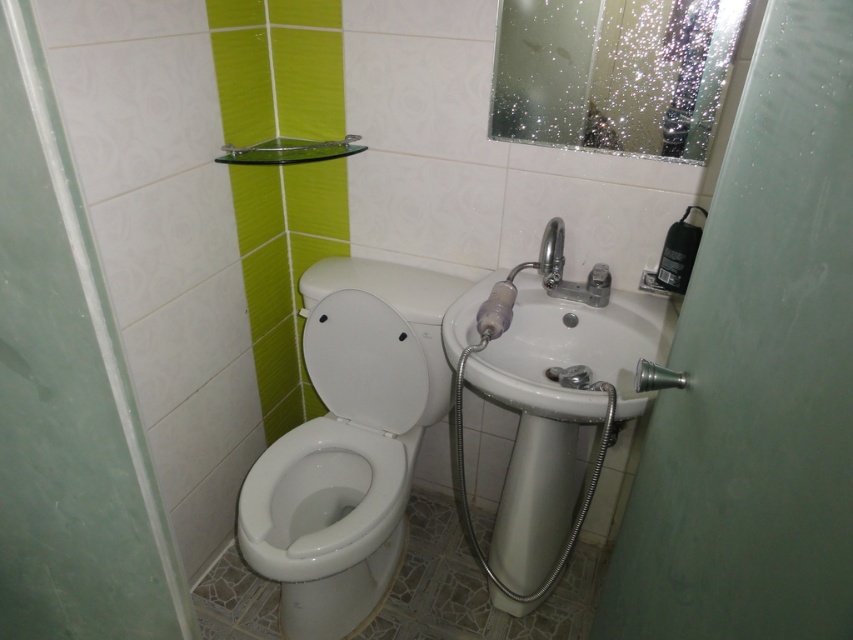
Question: Estimate the real-world distances between objects in this image. Which object is farther from the white glossy toilet at lower left?

Choices:
 (A) polished chrome faucet at upper right
 (B) white glossy bidet at center

Answer: (A)

Question: Does white glossy bidet at center have a lesser width compared to polished chrome faucet at upper right?

Choices:
 (A) yes
 (B) no

Answer: (B)

Question: Is white glossy toilet at lower left to the right of polished chrome faucet at upper right from the viewer's perspective?

Choices:
 (A) no
 (B) yes

Answer: (A)

Question: Considering the real-world distances, which object is closest to the white glossy bidet at center?

Choices:
 (A) polished chrome faucet at upper right
 (B) matte silver shower head at lower right

Answer: (A)

Question: Among these points, which one is farthest from the camera?

Choices:
 (A) (556, 246)
 (B) (317, 580)
 (C) (363, 497)
 (D) (677, 376)

Answer: (C)

Question: Does white glossy bidet at center appear on the left side of matte silver shower head at lower right?

Choices:
 (A) no
 (B) yes

Answer: (B)